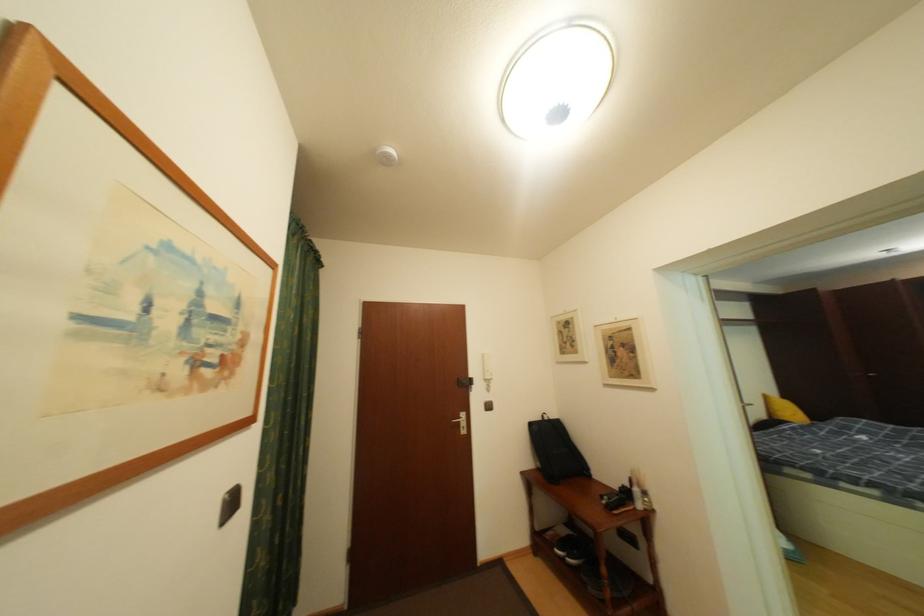
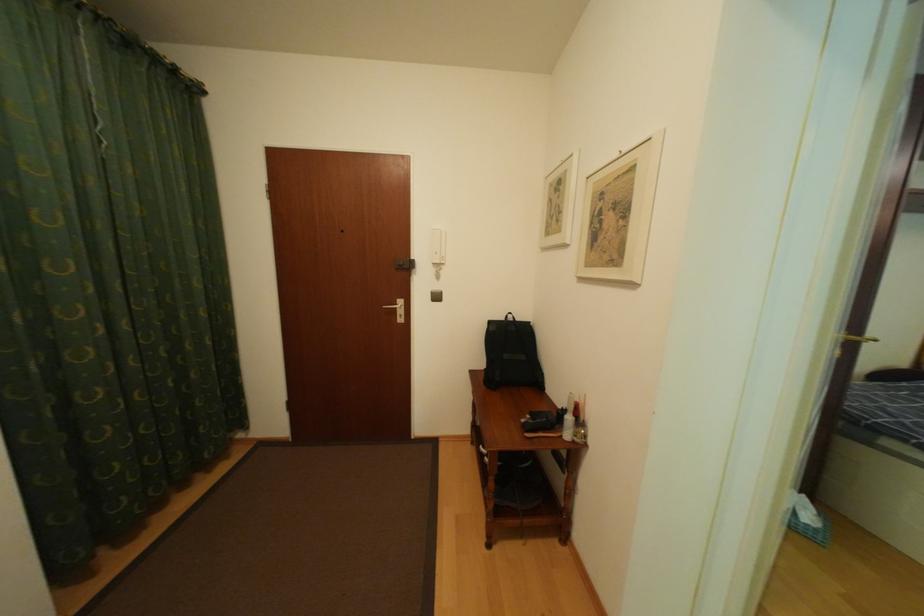
In the second image, find the point that corresponds to point (477, 384) in the first image.

(414, 265)